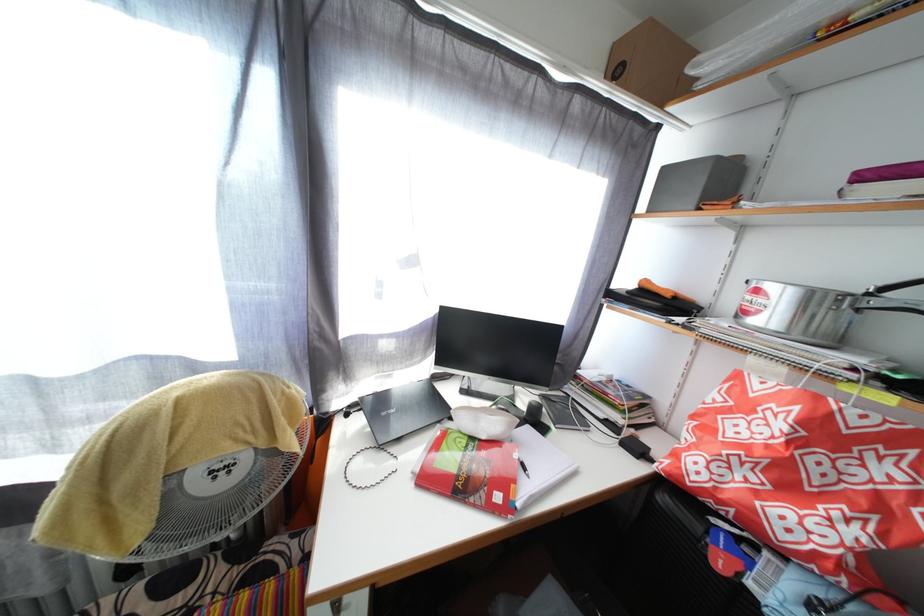
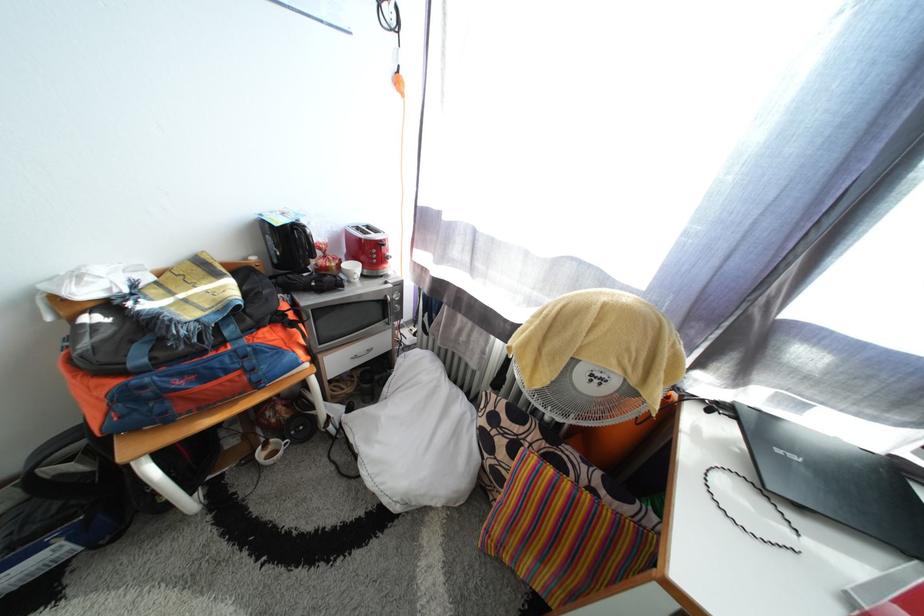
First-person continuous shooting, in which direction is the camera rotating?

The rotation direction of the camera is left-down.